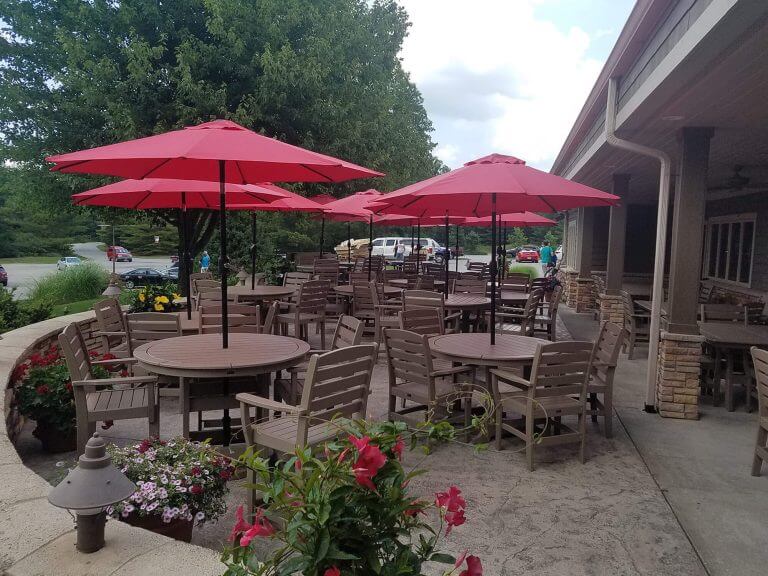
This screenshot has height=576, width=768. Find the location of `round tables`. round tables is located at coordinates (494, 357), (240, 367), (266, 287), (461, 301), (392, 288), (511, 295), (402, 279), (306, 266).